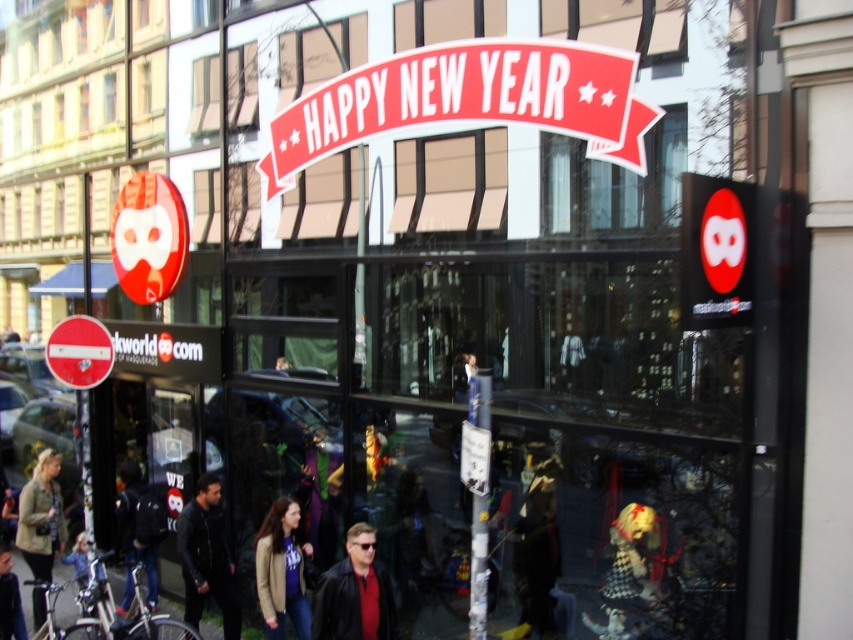
Looking at this image, who is positioned more to the left, matte black jacket at center or dark blue leather jacket at lower left?

dark blue leather jacket at lower left is more to the left.

Does matte black jacket at center have a greater width compared to dark blue leather jacket at lower left?

Yes.

Image resolution: width=853 pixels, height=640 pixels. What do you see at coordinates (354, 593) in the screenshot? I see `matte black jacket at center` at bounding box center [354, 593].

Find the location of a particular element. matte black jacket at center is located at coordinates (354, 593).

Does point (241, 620) lie in front of point (287, 536)?

No, it is not.

Locate an element on the screen. dark blue leather jacket at lower left is located at coordinates (206, 557).

Who is lower down, matte black jacket at center or red plastic circle at left?

matte black jacket at center

Does point (323, 593) come behind point (97, 339)?

No.

Where is `matte black jacket at center`? The width and height of the screenshot is (853, 640). matte black jacket at center is located at coordinates (354, 593).